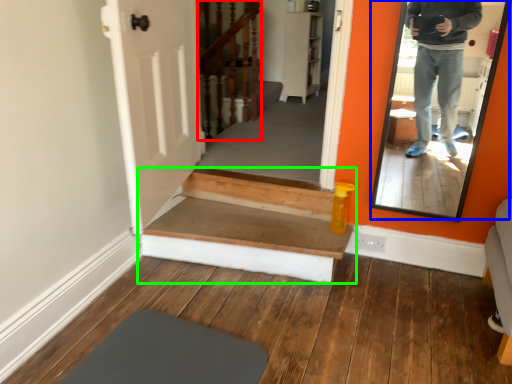
Question: Estimate the real-world distances between objects in this image. Which object is farther from stairwell (highlighted by a red box), mirror (highlighted by a blue box) or stairs (highlighted by a green box)?

Choices:
 (A) mirror
 (B) stairs

Answer: (A)